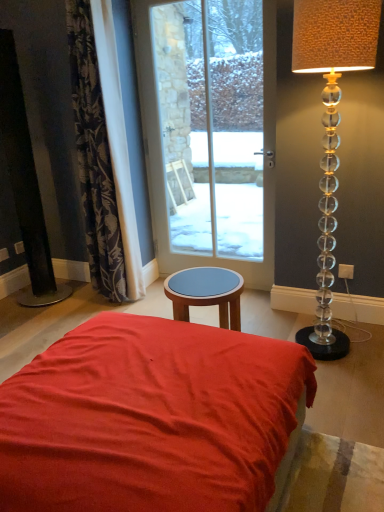
The width and height of the screenshot is (384, 512). I want to click on empty space that is ontop of matte red fabric bed at center, so click(169, 349).